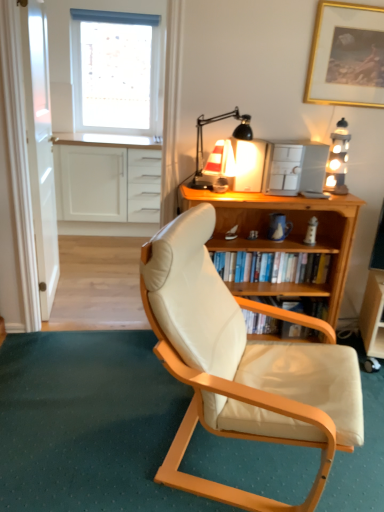
Question: In the image, is wooden bookshelf at center positioned in front of or behind gold-framed picture at upper right?

Choices:
 (A) front
 (B) behind

Answer: (A)

Question: From their relative heights in the image, would you say wooden bookshelf at center is taller or shorter than gold-framed picture at upper right?

Choices:
 (A) short
 (B) tall

Answer: (B)

Question: Considering the real-world distances, which object is closest to the white matte window at upper left?

Choices:
 (A) white matte cabinet at upper left
 (B) matte cream leather chair at center
 (C) wooden bookshelf at right
 (D) gold-framed picture at upper right
 (E) transparent glass door at left

Answer: (A)

Question: Which object is the closest to the gold-framed picture at upper right?

Choices:
 (A) wooden bookshelf at center
 (B) transparent glass door at left
 (C) matte black table lamp at upper center
 (D) matte cream leather chair at center
 (E) white leather chair at center

Answer: (C)